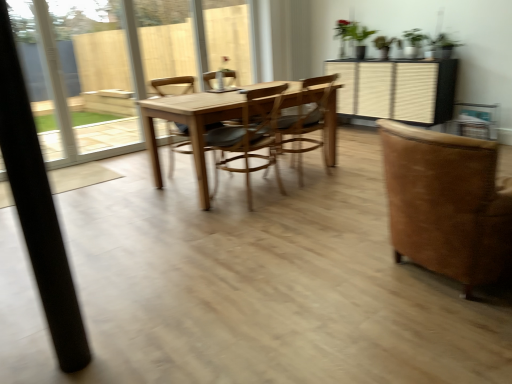
Identify the location of vacant space to the left of wooden chair at center, positioned as the first chair in left-to-right order. This screenshot has height=384, width=512. [141, 177].